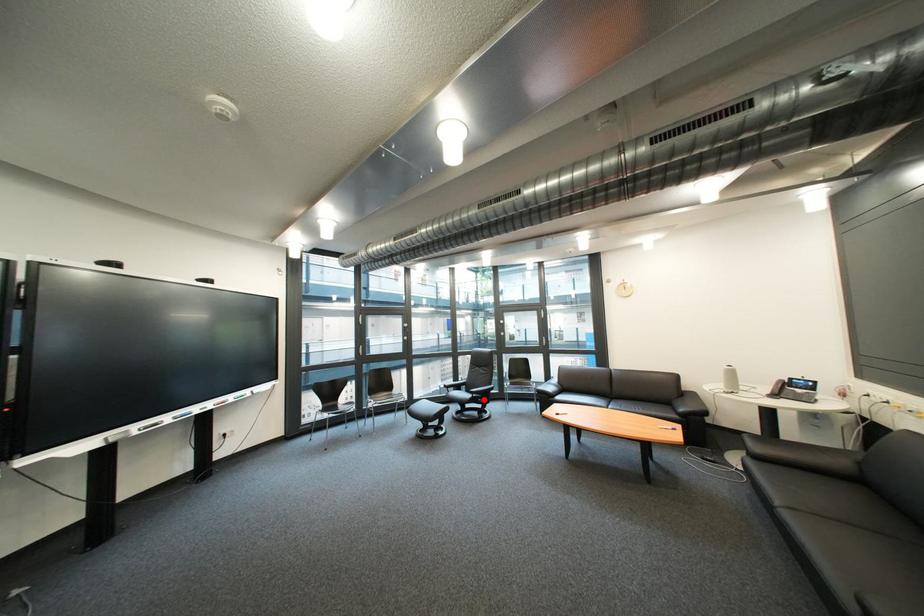
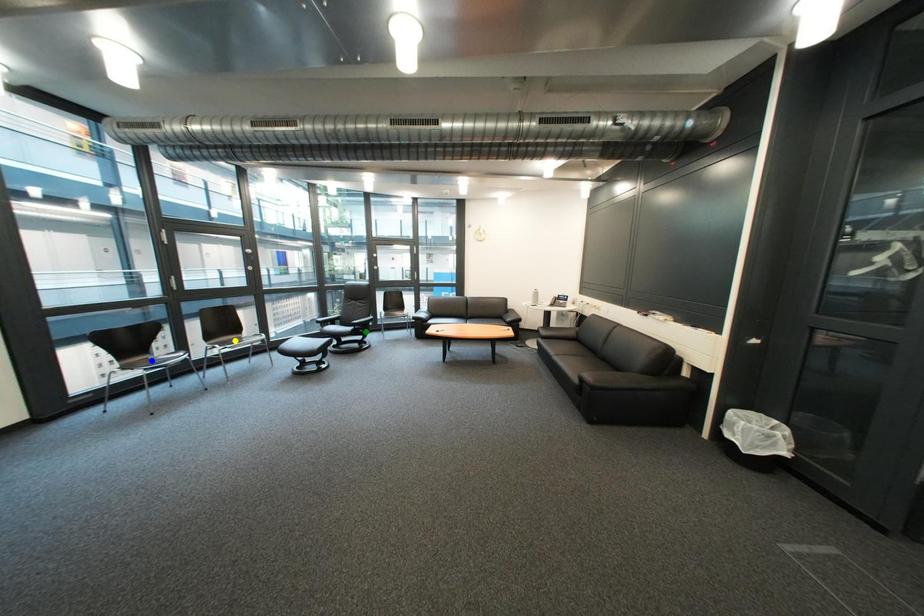
Question: I am providing you with two images of the same scene from different viewpoints. A red point is marked on the first image. You are given multiple points on the second image. Can you choose the point in image 2 that corresponds to the point in image 1?

Choices:
 (A) blue point
 (B) green point
 (C) yellow point

Answer: (B)